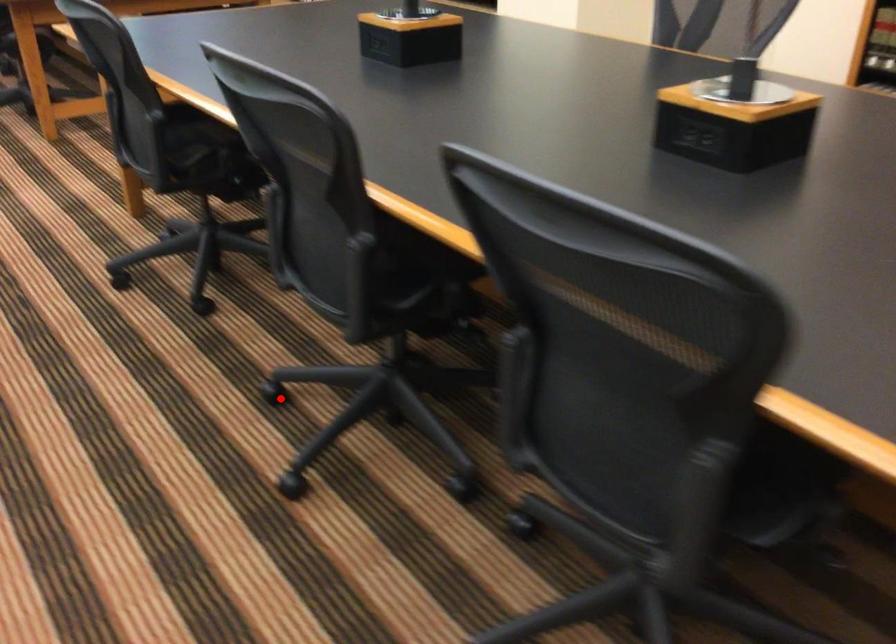
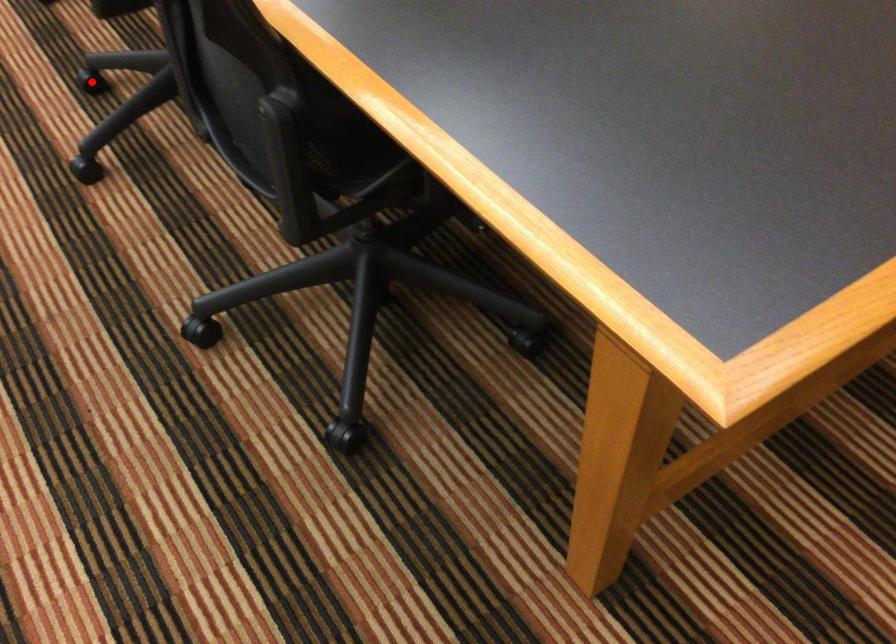
I am providing you with two images of the same scene from different viewpoints. A red point is marked on the first image and another point is marked on the second image. Do the highlighted points in image1 and image2 indicate the same real-world spot?

Yes